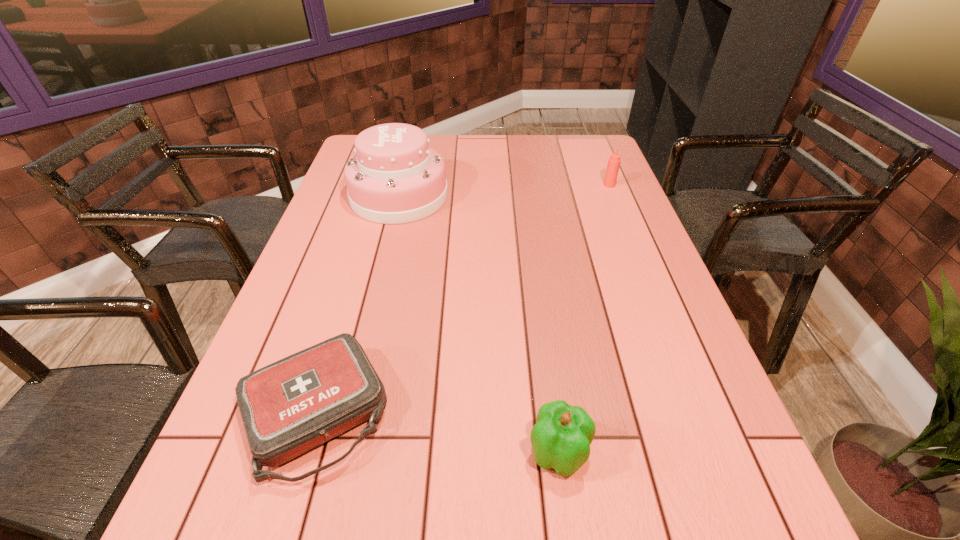
At what (x,y) coordinates should I click in order to perform the action: click on the tallest object. Please return your answer as a coordinate pair (x, y). Looking at the image, I should click on (394, 178).

You are a GUI agent. You are given a task and a screenshot of the screen. Output one action in this format:
    pyautogui.click(x=<x>, y=<y>)
    Task: Click on the Tabasco sauce
    This screenshot has height=540, width=960.
    Given the screenshot: What is the action you would take?
    pyautogui.click(x=614, y=161)

Find the location of a particular element. The image size is (960, 540). the second object from right to left is located at coordinates (561, 438).

Where is `the shortest object`? the shortest object is located at coordinates (295, 404).

I want to click on vacant space located on the front of the cake, so click(383, 264).

Locate an element on the screen. Image resolution: width=960 pixels, height=540 pixels. free region located 0.180m on the front of the rightmost object is located at coordinates (624, 221).

I want to click on vacant space located 0.270m on the left of the third object from left to right, so (374, 453).

Find the location of `vacant region located on the front of the shortest object`. vacant region located on the front of the shortest object is located at coordinates (281, 530).

The image size is (960, 540). I want to click on cake at the left edge, so click(x=394, y=178).

Locate an element on the screen. This screenshot has height=540, width=960. the first-aid kit positioned at the left edge is located at coordinates (295, 404).